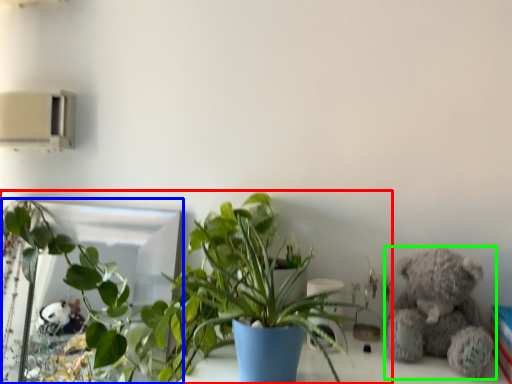
Question: Which object is the closest to the houseplant (highlighted by a red box)? Choose among these: mirror (highlighted by a blue box) or teddy bear (highlighted by a green box).

Choices:
 (A) mirror
 (B) teddy bear

Answer: (A)